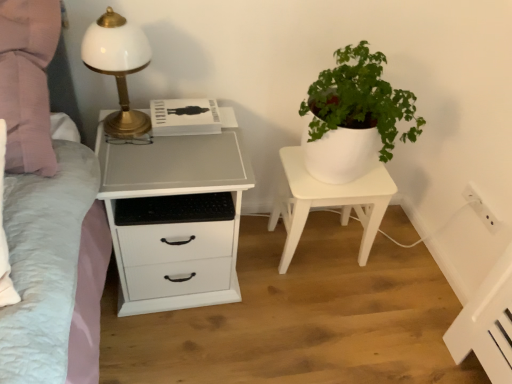
Find the location of `free space in front of white matte plant pot at center`. free space in front of white matte plant pot at center is located at coordinates (323, 309).